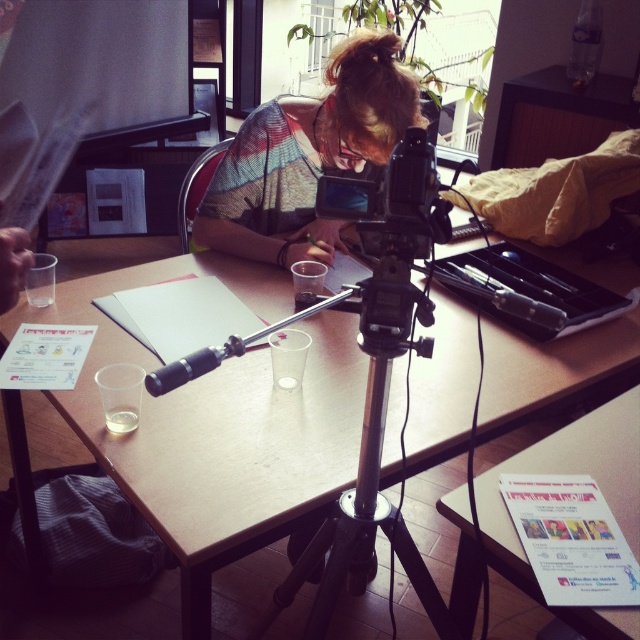
You are organizing a small event and need to place a 12 inch wide decorative item between the knitted sweater at center and the black plastic camera at center. Can you fit it without moving either object?

The distance between the knitted sweater at center and the black plastic camera at center is 24.60 inches. Since the decorative item is only 12 inches wide, there is enough space to place it between them without moving either object.

You are organizing a photo shoot and need to place the knitted sweater at center and the black plastic camera at center on a shelf. If the shelf has limited vertical space, which item might not fit if the height restriction is exactly the same as the taller object?

The knitted sweater at center is taller than the black plastic camera at center, so if the shelf height matches the taller object, the knitted sweater at center might not fit.

From the picture: You are setting up for a photo shoot and need to place the black plastic camera at center so it can capture the wooden table at center from the side. Based on their positions, will the camera be able to capture the table properly?

The wooden table at center is positioned on the right side of black plastic camera at center, so the camera can capture the table from the side as desired.